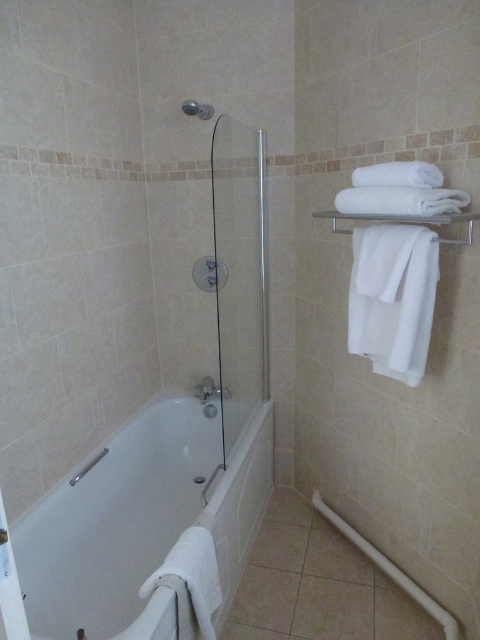
Does white glossy bathtub at center have a smaller size compared to clear glass shower door at center?

No, white glossy bathtub at center is not smaller than clear glass shower door at center.

This screenshot has width=480, height=640. Find the location of `white glossy bathtub at center`. white glossy bathtub at center is located at coordinates (141, 524).

Between point (228, 509) and point (254, 344), which one is positioned in front?

Point (228, 509) is more forward.

The height and width of the screenshot is (640, 480). Identify the location of white glossy bathtub at center. (141, 524).

Between matte silver shower at upper center and brushed metal shower at lower left, which one is positioned lower?

brushed metal shower at lower left is below.

Is matte silver shower at upper center taller than brushed metal shower at lower left?

Yes.

Where is `matte silver shower at upper center`? The image size is (480, 640). matte silver shower at upper center is located at coordinates (197, 109).

Is point (237, 163) more distant than point (208, 113)?

No.

From the picture: Who is more forward, (245, 180) or (195, 104)?

Point (195, 104) is in front.

Which is in front, point (240, 339) or point (204, 109)?

Positioned in front is point (204, 109).

Image resolution: width=480 pixels, height=640 pixels. I want to click on clear glass shower door at center, so click(x=239, y=273).